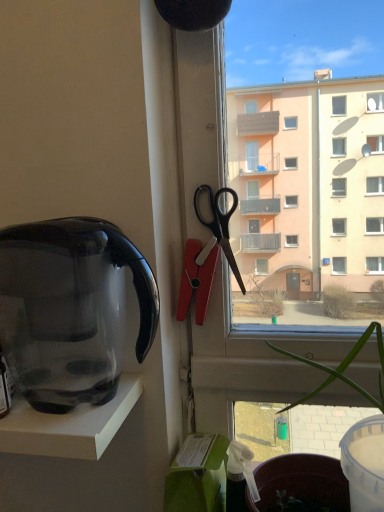
Question: From the image's perspective, relative to black plastic scissors at upper right, is transparent plastic kettle at left above or below?

Choices:
 (A) below
 (B) above

Answer: (A)

Question: From a real-world perspective, is transparent plastic kettle at left physically located above or below black plastic scissors at upper right?

Choices:
 (A) below
 (B) above

Answer: (A)

Question: Which object is the farthest from the green leafy plant at center?

Choices:
 (A) transparent plastic kettle at left
 (B) black plastic scissors at upper right

Answer: (A)

Question: Which is nearer to the green leafy plant at center?

Choices:
 (A) black plastic scissors at upper right
 (B) transparent plastic kettle at left

Answer: (A)